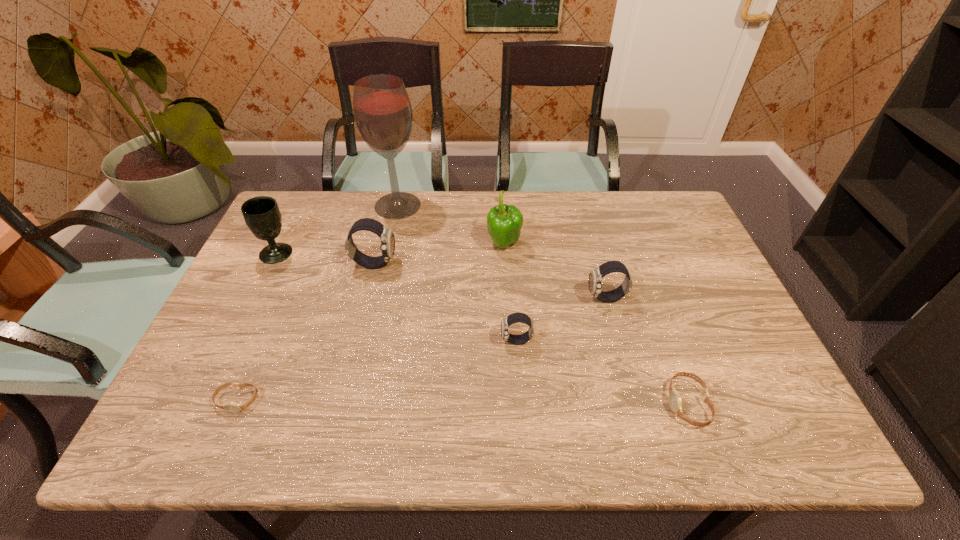
I want to click on chalice situated at the left edge, so click(x=261, y=214).

Find the location of a particular element. watch at the left edge is located at coordinates (233, 407).

Where is `object that is positioned at the near left corner`? object that is positioned at the near left corner is located at coordinates (233, 407).

This screenshot has height=540, width=960. What are the coordinates of `vacant space at the far edge` in the screenshot? It's located at (527, 234).

In the image, there is a desktop. What are the coordinates of `blank space at the near edge` in the screenshot? It's located at (256, 448).

Where is `free region at the left edge`? free region at the left edge is located at coordinates (279, 295).

The width and height of the screenshot is (960, 540). I want to click on vacant region at the right edge of the desktop, so click(684, 282).

This screenshot has height=540, width=960. What are the coordinates of `vacant space at the far right corner of the desktop` in the screenshot? It's located at (675, 204).

You are a GUI agent. You are given a task and a screenshot of the screen. Output one action in this format:
    pyautogui.click(x=<x>, y=<y>)
    Task: Click on the vacant area between the farthest dark watch and the chalice
    
    Given the screenshot: What is the action you would take?
    pyautogui.click(x=325, y=258)

At what (x,y) coordinates should I click in order to perform the action: click on vacant space that is in between the chalice and the second shortest watch. Please return your answer as a coordinate pair (x, y). This screenshot has width=960, height=540. Looking at the image, I should click on (482, 328).